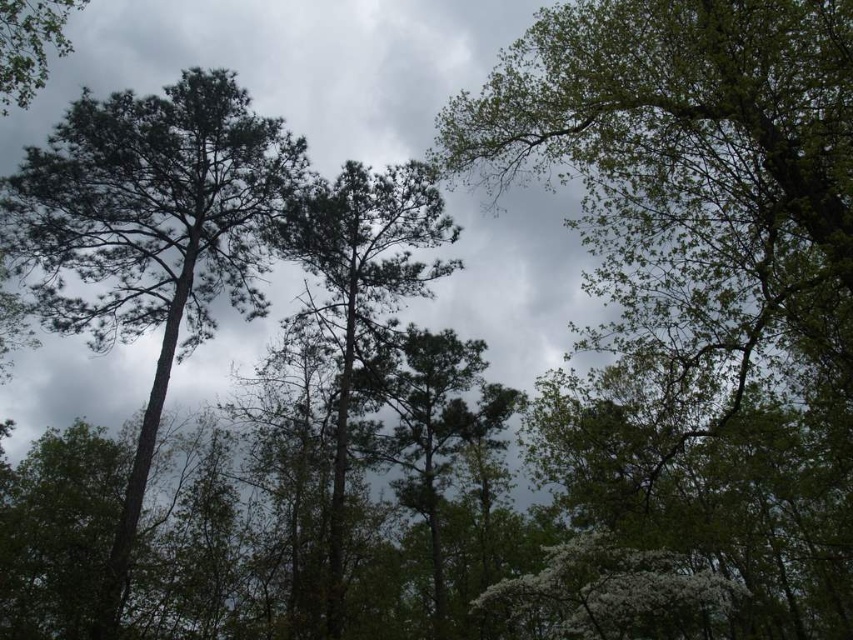
You are a hiker standing at the base of the green matte tree at left. You want to take a photo of the tree from a distance where it appears smaller in the frame. If you move 5 meters away from the tree, will it still be visible in the photo? Explain your reasoning.

The green matte tree at left is currently 14.05 meters away from the camera. If you move an additional 5 meters away, the new distance becomes 19.05 meters. Since increasing the distance from the subject makes it appear smaller in the frame, the tree will still be visible but smaller. However, visibility depends on the camera lens and field of view, but based on distance alone, yes, it will still be visible.

You are a bird soaring above the forest canopy. You spot the green matte tree at left and the green leafy tree at upper left. Which tree is positioned lower in the sky?

The green matte tree at left is positioned lower than the green leafy tree at upper left, so the green matte tree at left is lower in the sky.

Consider the image. You are a bird flying through the forest and want to land on a branch. You see the green matte tree at center and the green leafy tree at upper left. Which tree is located to the right of the other?

The green matte tree at center is positioned on the right side of green leafy tree at upper left.